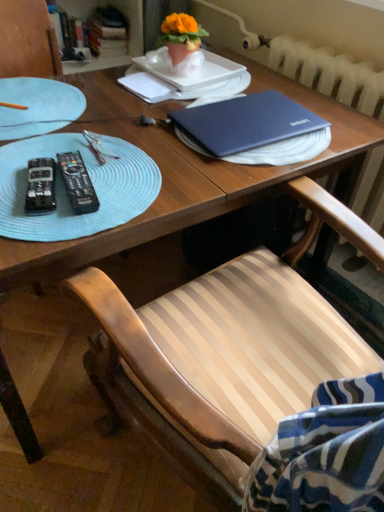
Locate an element on the screen. vacant area that lies between black plastic remote control at left, which appears as the 1th remote control when viewed from the left, and white paper at upper center is located at coordinates (108, 126).